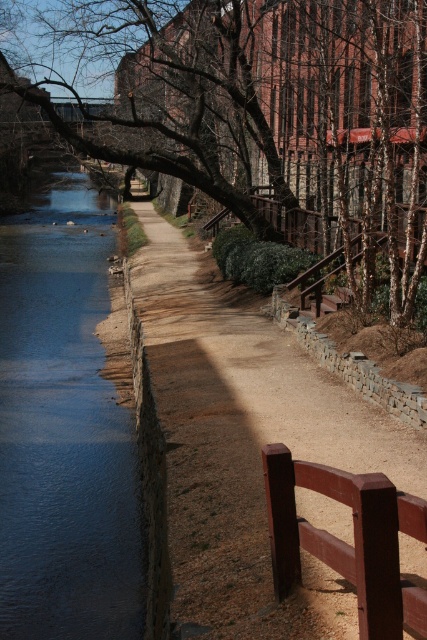
Question: Can you confirm if brown gravel path at center is smaller than blue smooth water at left?

Choices:
 (A) yes
 (B) no

Answer: (A)

Question: Which is nearer to the bare branches at upper center?

Choices:
 (A) brown gravel path at center
 (B) blue smooth water at left

Answer: (B)

Question: Can you confirm if bare branches at upper center is bigger than brown gravel path at center?

Choices:
 (A) no
 (B) yes

Answer: (B)

Question: Is brown gravel path at center closer to the viewer compared to blue smooth water at left?

Choices:
 (A) no
 (B) yes

Answer: (B)

Question: Which object is farther from the camera taking this photo?

Choices:
 (A) brown gravel path at center
 (B) blue smooth water at left

Answer: (B)

Question: Which point appears closest to the camera in this image?

Choices:
 (A) (332, 65)
 (B) (35, 600)

Answer: (B)